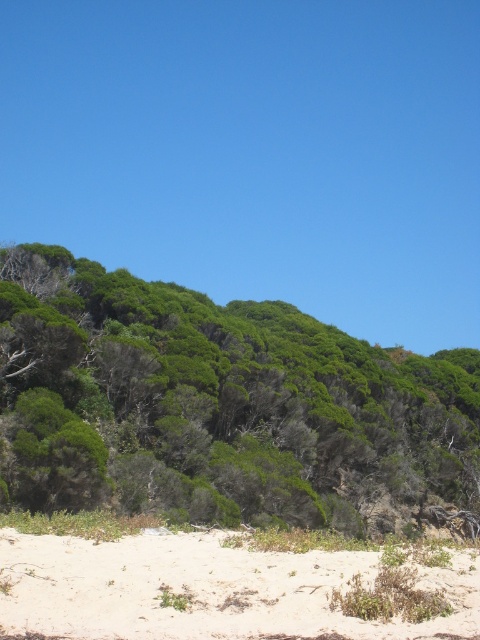
Does green leafy bush at upper center have a lesser height compared to white sandy beach at lower center?

No, green leafy bush at upper center is not shorter than white sandy beach at lower center.

Between green leafy bush at upper center and white sandy beach at lower center, which one is positioned higher?

green leafy bush at upper center is above.

Describe the element at coordinates (222, 406) in the screenshot. I see `green leafy bush at upper center` at that location.

Find the location of a particular element. This screenshot has height=640, width=480. green leafy bush at upper center is located at coordinates (222, 406).